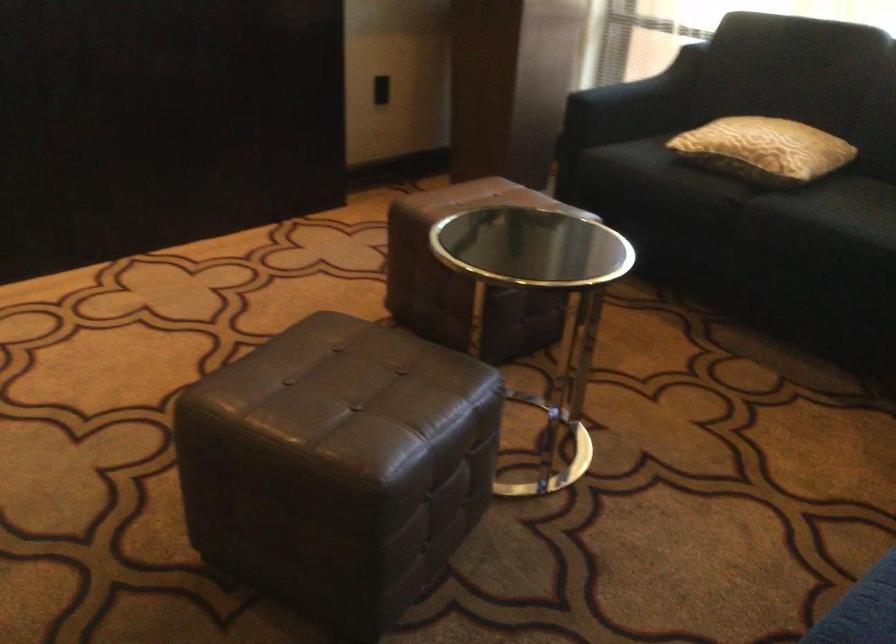
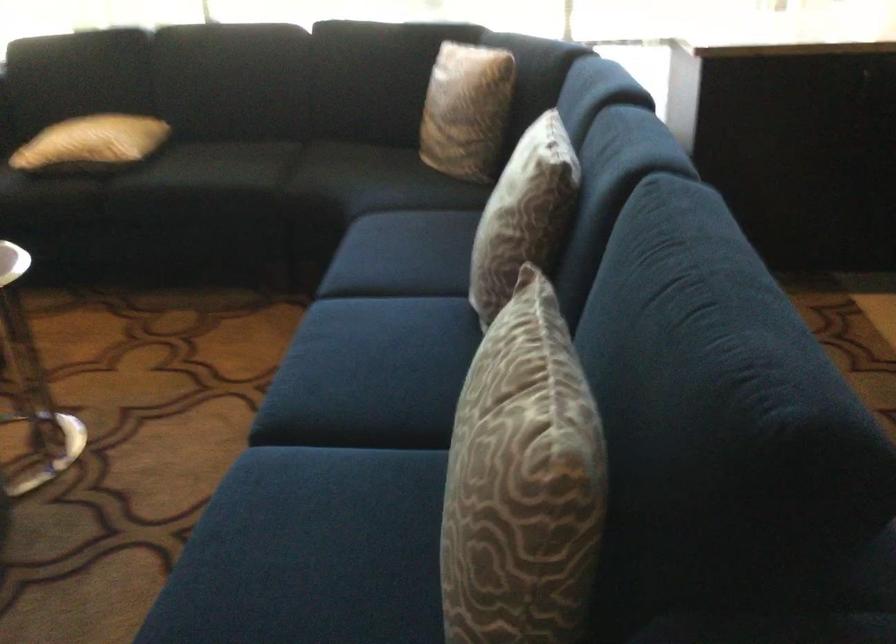
The point at (762, 146) is marked in the first image. Where is the corresponding point in the second image?

(91, 142)